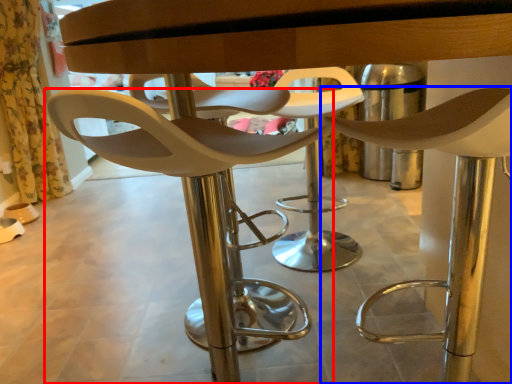
Question: Which of the following is the farthest to the observer, chair (highlighted by a red box) or chair (highlighted by a blue box)?

Choices:
 (A) chair
 (B) chair

Answer: (A)